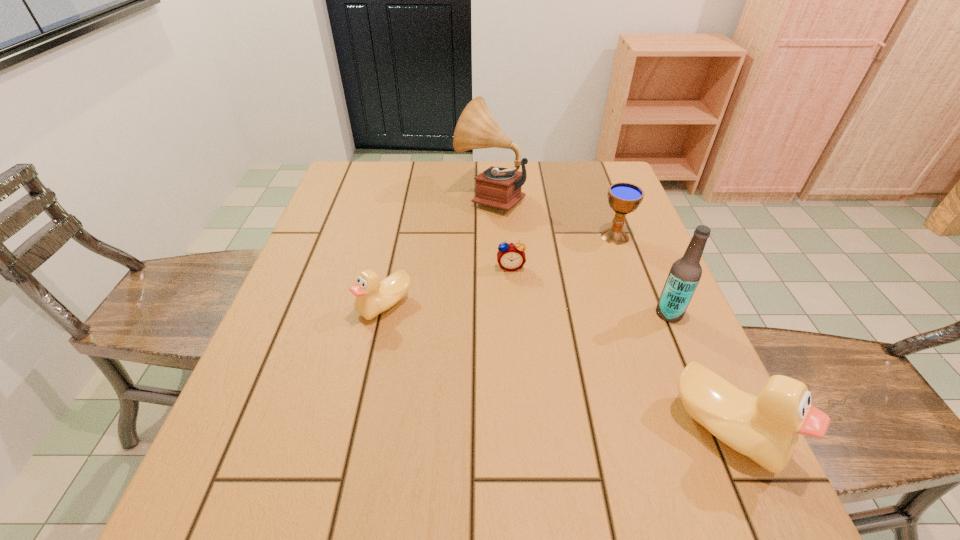
At what (x,y) coordinates should I click in order to perform the action: click on the second farthest object. Please return your answer as a coordinate pair (x, y). The image size is (960, 540). Looking at the image, I should click on (624, 198).

Find the location of a particular element. free region located 0.110m at the beak of the fifth tallest object is located at coordinates (309, 305).

Find the location of a particular element. The image size is (960, 540). vacant region located at the beak of the fifth tallest object is located at coordinates (331, 305).

Where is `vacant space positioned 0.110m at the beak of the fifth tallest object`? The height and width of the screenshot is (540, 960). vacant space positioned 0.110m at the beak of the fifth tallest object is located at coordinates (309, 305).

At what (x,y) coordinates should I click in order to perform the action: click on vacant position located on the horn of the phonograph record. Please return your answer as a coordinate pair (x, y). Looking at the image, I should click on (389, 196).

Locate an element on the screen. vacant space situated 0.220m on the horn of the phonograph record is located at coordinates (382, 196).

The height and width of the screenshot is (540, 960). What are the coordinates of `free spot located on the horn of the phonograph record` in the screenshot? It's located at (342, 196).

Identify the location of blank space located 0.300m on the label of the beer bottle. (519, 313).

You are a GUI agent. You are given a task and a screenshot of the screen. Output one action in this format:
    pyautogui.click(x=<x>, y=<y>)
    Task: Click on the vacant space located on the label of the beer bottle
    Image resolution: width=960 pixels, height=540 pixels.
    Given the screenshot: What is the action you would take?
    pos(561,313)

This screenshot has width=960, height=540. Find the location of `vacant point located on the label of the beer bottle`. vacant point located on the label of the beer bottle is located at coordinates (556, 313).